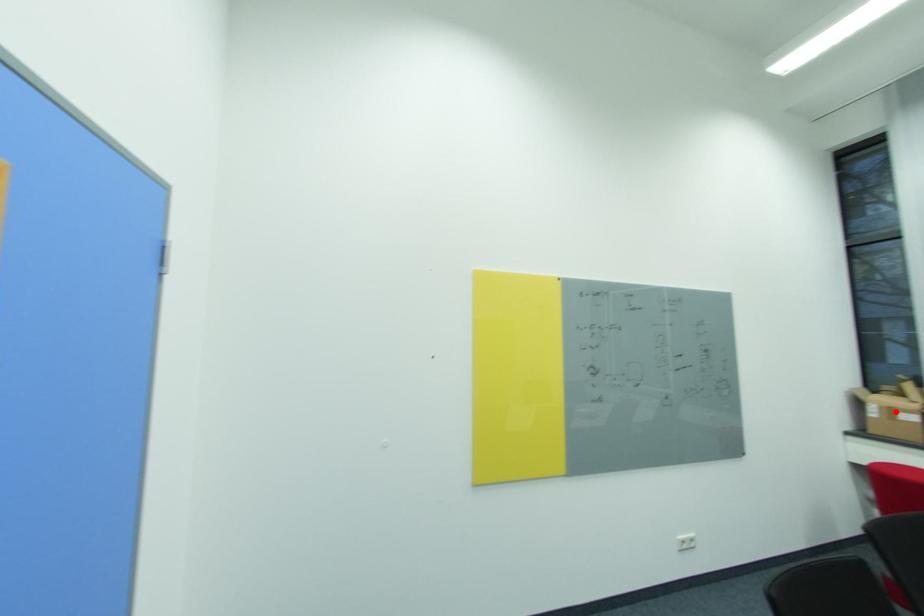
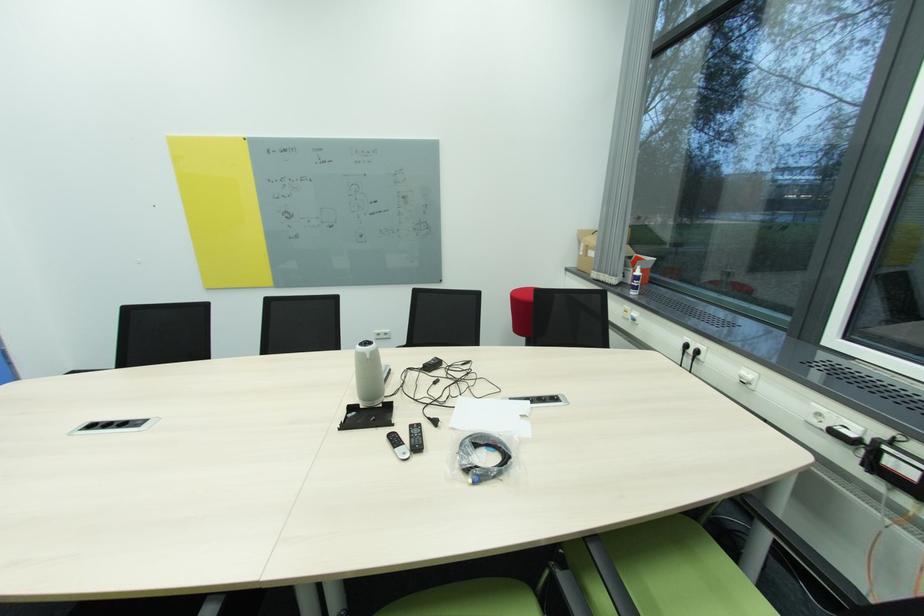
In the second image, find the point that corresponds to the highlighted location in the first image.

(591, 249)